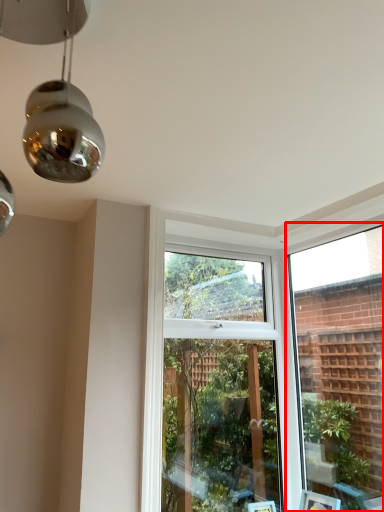
Question: From the image, what is the correct spatial relationship of window frame (annotated by the red box) in relation to window?

Choices:
 (A) right
 (B) left

Answer: (A)